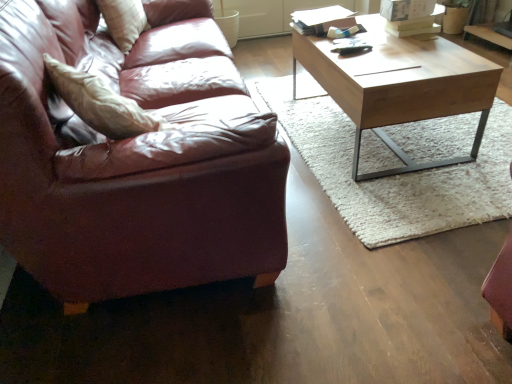
Question: Is light brown wood coffee table at center thinner than leather couch at left?

Choices:
 (A) yes
 (B) no

Answer: (B)

Question: Does light brown wood coffee table at center appear on the left side of leather couch at left?

Choices:
 (A) yes
 (B) no

Answer: (B)

Question: Is light brown wood coffee table at center closer to the viewer compared to leather couch at left?

Choices:
 (A) yes
 (B) no

Answer: (B)

Question: Is light brown wood coffee table at center shorter than leather couch at left?

Choices:
 (A) no
 (B) yes

Answer: (B)

Question: From a real-world perspective, is light brown wood coffee table at center positioned over leather couch at left based on gravity?

Choices:
 (A) yes
 (B) no

Answer: (B)

Question: Is light brown wood coffee table at center looking in the opposite direction of leather couch at left?

Choices:
 (A) yes
 (B) no

Answer: (A)

Question: From the image's perspective, is leather couch at left beneath light brown wood coffee table at center?

Choices:
 (A) no
 (B) yes

Answer: (B)

Question: Is leather couch at left at the left side of light brown wood coffee table at center?

Choices:
 (A) no
 (B) yes

Answer: (B)

Question: From the image's perspective, is leather couch at left on light brown wood coffee table at center?

Choices:
 (A) no
 (B) yes

Answer: (A)

Question: Is leather couch at left touching light brown wood coffee table at center?

Choices:
 (A) no
 (B) yes

Answer: (A)

Question: Is leather couch at left behind light brown wood coffee table at center?

Choices:
 (A) yes
 (B) no

Answer: (B)

Question: Considering the relative sizes of leather couch at left and light brown wood coffee table at center in the image provided, is leather couch at left taller than light brown wood coffee table at center?

Choices:
 (A) no
 (B) yes

Answer: (B)

Question: Considering the relative sizes of leather couch at left and plush white pillow at upper left in the image provided, is leather couch at left taller than plush white pillow at upper left?

Choices:
 (A) no
 (B) yes

Answer: (B)